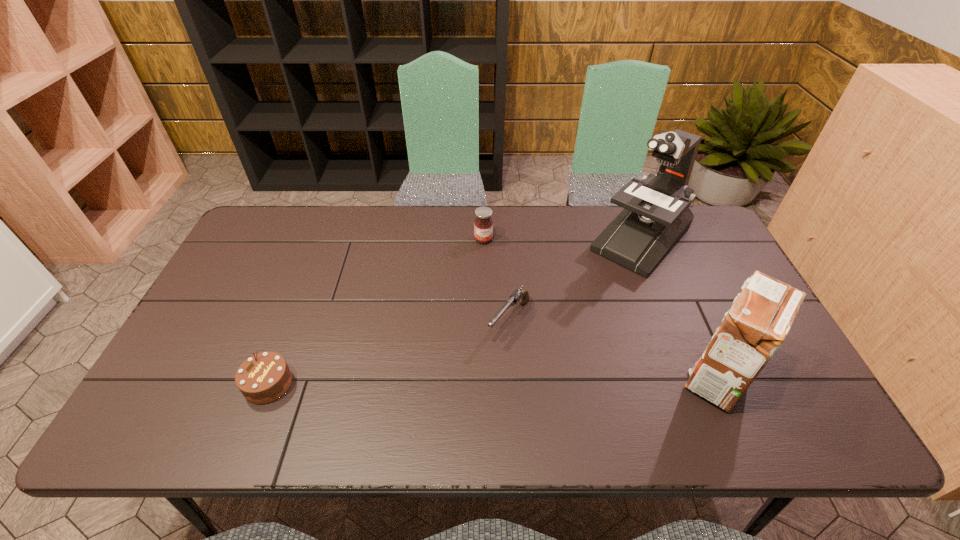
I want to click on vacant space at the near right corner, so click(787, 384).

This screenshot has height=540, width=960. Find the location of `empty space that is in between the gun and the third tallest object`. empty space that is in between the gun and the third tallest object is located at coordinates (496, 280).

I want to click on vacant region between the tallest object and the chocolate cake, so click(454, 312).

Identify the location of vacant area that lies between the carton and the tallest object. (679, 309).

Locate an element on the screen. empty space between the tallest object and the second tallest object is located at coordinates (679, 309).

The image size is (960, 540). Identify the location of free space that is in between the jam and the second tallest object. (600, 309).

What are the coordinates of `vacant space that is in between the carton and the microscope` in the screenshot? It's located at (679, 309).

You are a GUI agent. You are given a task and a screenshot of the screen. Output one action in this format:
    pyautogui.click(x=<x>, y=<y>)
    Task: Click on the empty location between the tallest object and the chocolate cake
    
    Given the screenshot: What is the action you would take?
    pyautogui.click(x=454, y=312)

Find the location of `vacant area that lies between the jam and the chocolate cake`. vacant area that lies between the jam and the chocolate cake is located at coordinates (376, 312).

Locate an element on the screen. vacant area that lies between the leftmost object and the carton is located at coordinates (492, 381).